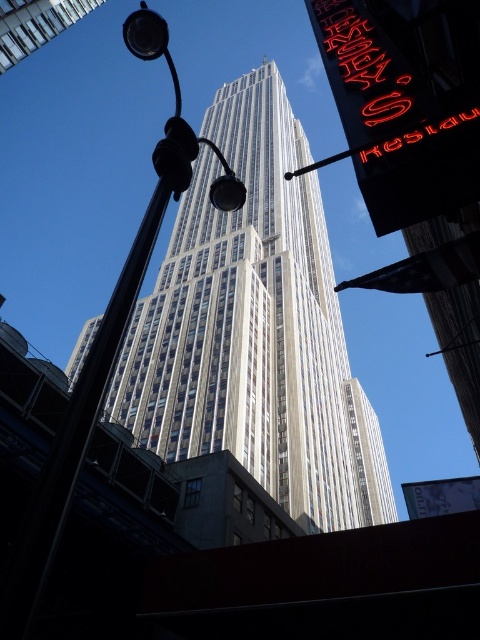
You are standing on the sidewalk in front of the Empire State Building. You want to take a photo of the white glass skyscraper at center. Where should you position yourself relative to the streetlamp with two spherical lights to ensure the skyscraper is centered in your viewfinder?

To center the white glass skyscraper at center in your viewfinder, position yourself directly in front of the streetlamp with two spherical lights, as the skyscraper is located at the central point of the image marked by coordinates.

Based on the photo, you are a photographer planning to capture the Empire State Building. You have a camera with a 10cm wide lens. The white glass skyscraper at center and the metallic streetlight at center are both in your shot. Which object will occupy more space horizontally in your photo?

The white glass skyscraper at center will occupy more horizontal space in the photo because its width is larger than that of the metallic streetlight at center.